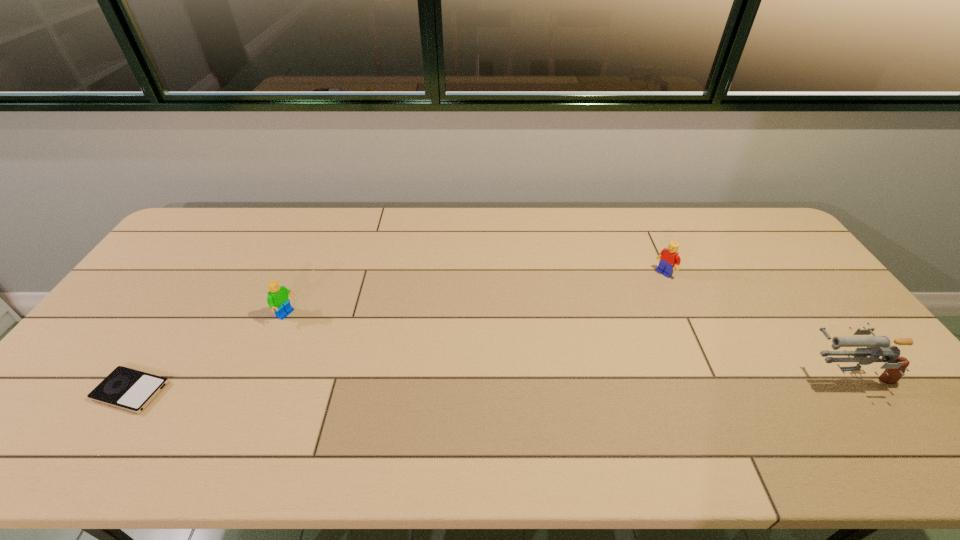
The width and height of the screenshot is (960, 540). I want to click on iPod, so click(x=125, y=388).

In order to click on the leftmost object in this screenshot , I will do `click(125, 388)`.

Where is `the rightmost object`? This screenshot has height=540, width=960. the rightmost object is located at coordinates (876, 346).

Where is `gun`? The width and height of the screenshot is (960, 540). gun is located at coordinates (876, 346).

Image resolution: width=960 pixels, height=540 pixels. What are the coordinates of `the nearer Lego` in the screenshot? It's located at (277, 299).

Identify the location of the third nearest object. (277, 299).

Find the location of a particular element. The image size is (960, 540). the farther Lego is located at coordinates (669, 257).

Identify the location of the right Lego. (669, 257).

In order to click on free spot located 0.370m on the back of the iPod in this screenshot , I will do `click(209, 273)`.

Image resolution: width=960 pixels, height=540 pixels. I want to click on vacant region located 0.360m at the barrel end of the gun, so click(x=660, y=374).